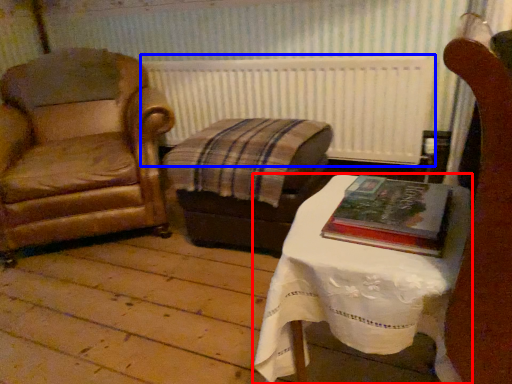
Question: Which object is further to the camera taking this photo, table (highlighted by a red box) or radiator (highlighted by a blue box)?

Choices:
 (A) table
 (B) radiator

Answer: (B)